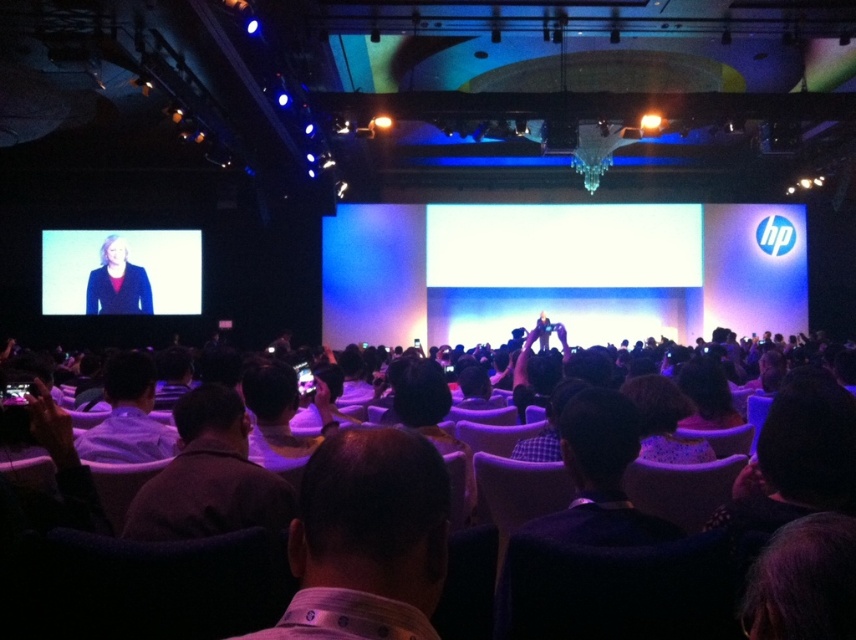
Based on the photo, you are a photographer at the event and need to capture a clear photo of both the dark brown shirt at center and the white shirt at lower left. Which shirt should you focus on first to ensure both are in frame?

The dark brown shirt at center occupies less space than white shirt at lower left, so you should focus on the white shirt at lower left first to ensure both fit within the frame.

You are an event photographer positioned at the back of the audience area. You need to take a photo of both the matte black jacket at upper left and the matte black jacket at left. Which jacket is closer to the front of the stage so that you can adjust your focus accordingly?

The matte black jacket at upper left is closer to the front of the stage than the matte black jacket at left, which is behind it. Adjust your focus to ensure both are in clear view.

You are a photographer at the event and need to capture a photo of both the dark brown shirt at center and the white shirt at lower left. Since you want both subjects to be clearly visible, which one should you focus on first considering their heights?

The dark brown shirt at center has a lesser height compared to the white shirt at lower left. To ensure both are clearly visible, focus on the white shirt at lower left first as it is taller, then adjust focus for the shorter dark brown shirt at center.